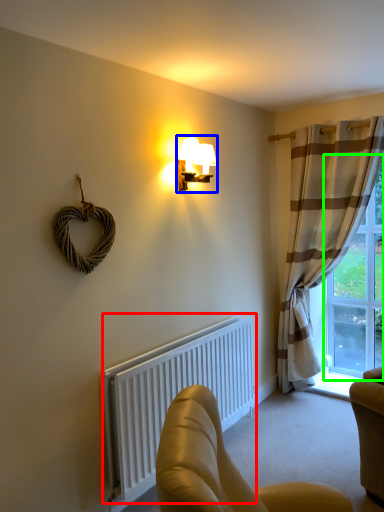
Question: Estimate the real-world distances between objects in this image. Which object is farther from radiator (highlighted by a red box), lamp (highlighted by a blue box) or window (highlighted by a green box)?

Choices:
 (A) lamp
 (B) window

Answer: (B)